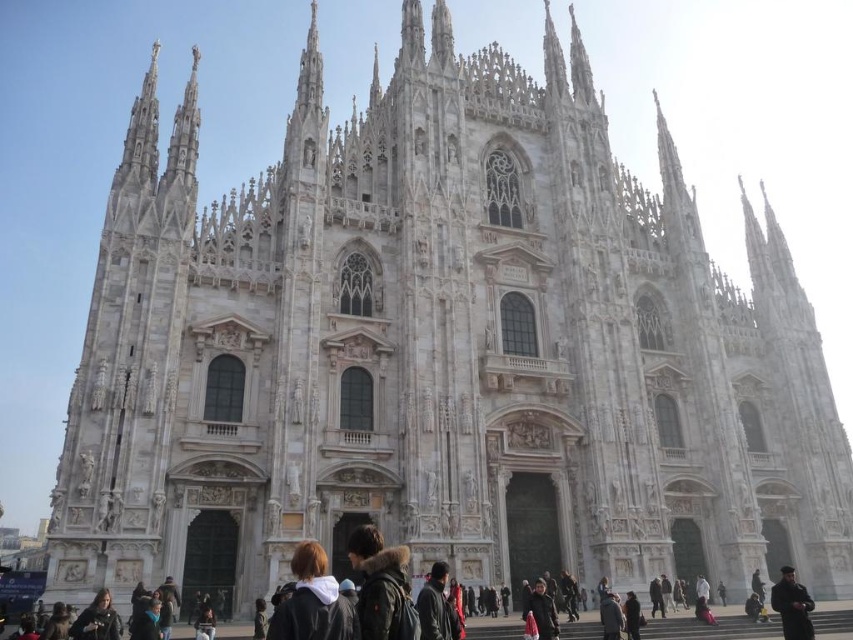
Is dark brown hair at lower center thinner than black leather jacket at lower right?

Indeed, dark brown hair at lower center has a lesser width compared to black leather jacket at lower right.

Which is behind, point (300, 627) or point (788, 636)?

The point (788, 636) is more distant.

Between point (320, 547) and point (793, 636), which one is positioned behind?

Point (793, 636)

Find the location of a particular element. This screenshot has height=640, width=853. dark brown hair at lower center is located at coordinates (312, 600).

Is point (381, 611) less distant than point (799, 624)?

Yes, it is.

Is dark brown fur-lined jacket at center taller than black leather jacket at lower right?

Incorrect, dark brown fur-lined jacket at center's height is not larger of black leather jacket at lower right's.

Looking at this image, who is more forward, (376, 554) or (787, 595)?

Point (376, 554) is more forward.

The height and width of the screenshot is (640, 853). What are the coordinates of `dark brown fur-lined jacket at center` in the screenshot? It's located at (379, 582).

Is dark brown hair at lower center thinner than dark brown fur-lined jacket at center?

Incorrect, dark brown hair at lower center's width is not less than dark brown fur-lined jacket at center's.

Which is behind, point (318, 636) or point (392, 579)?

The point (392, 579) is behind.

This screenshot has height=640, width=853. Find the location of `dark brown hair at lower center`. dark brown hair at lower center is located at coordinates (312, 600).